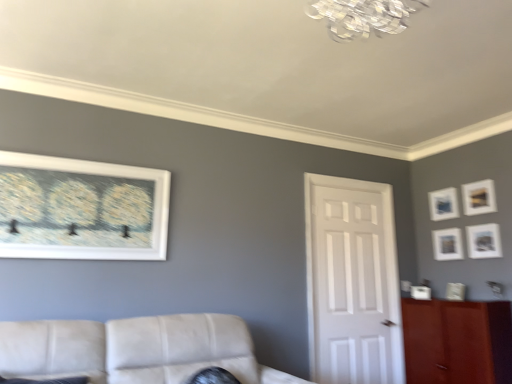
Question: Is brown wood cabinet at right facing away from white glossy door at center?

Choices:
 (A) no
 (B) yes

Answer: (A)

Question: Is brown wood cabinet at right at the left side of white glossy door at center?

Choices:
 (A) yes
 (B) no

Answer: (B)

Question: Is there a large distance between brown wood cabinet at right and white glossy door at center?

Choices:
 (A) yes
 (B) no

Answer: (B)

Question: From a real-world perspective, is brown wood cabinet at right on top of white glossy door at center?

Choices:
 (A) no
 (B) yes

Answer: (A)

Question: From the image's perspective, is brown wood cabinet at right under white glossy door at center?

Choices:
 (A) no
 (B) yes

Answer: (B)

Question: Visually, is white matte picture frame at right, the third picture frame in the back-to-front sequence, positioned to the left or to the right of white glossy door at center?

Choices:
 (A) left
 (B) right

Answer: (B)

Question: In terms of height, does white matte picture frame at right, placed as the 2th picture frame when sorted from left to right, look taller or shorter compared to white glossy door at center?

Choices:
 (A) short
 (B) tall

Answer: (A)

Question: Considering their positions, is white matte picture frame at right, placed as the 2th picture frame when sorted from left to right, located in front of or behind white glossy door at center?

Choices:
 (A) front
 (B) behind

Answer: (B)

Question: Looking at the image, does white matte picture frame at right, placed as the 2th picture frame when sorted from left to right, seem bigger or smaller compared to white glossy door at center?

Choices:
 (A) small
 (B) big

Answer: (A)

Question: From a real-world perspective, is white matte picture frame at upper left, the first picture frame in the left-to-right sequence, above or below white matte picture frame at right, the fifth picture frame from the right?

Choices:
 (A) above
 (B) below

Answer: (A)

Question: Is white matte picture frame at upper left, the first picture frame viewed from the front, in front of or behind white matte picture frame at right, the fifth picture frame from the right, in the image?

Choices:
 (A) behind
 (B) front

Answer: (B)

Question: In terms of width, does white matte picture frame at upper left, arranged as the sixth picture frame when viewed from the right, look wider or thinner when compared to white matte picture frame at right, the fifth picture frame from the right?

Choices:
 (A) wide
 (B) thin

Answer: (B)

Question: From the image's perspective, is white matte picture frame at upper left, the first picture frame in the left-to-right sequence, above or below white matte picture frame at right, placed as the 2th picture frame when sorted from left to right?

Choices:
 (A) below
 (B) above

Answer: (B)

Question: Is matte white picture frame at right, which ranks as the 5th picture frame in back-to-front order, taller or shorter than white glossy door at center?

Choices:
 (A) short
 (B) tall

Answer: (A)

Question: Would you say matte white picture frame at right, placed as the 1th picture frame when sorted from right to left, is to the left or to the right of white glossy door at center in the picture?

Choices:
 (A) left
 (B) right

Answer: (B)